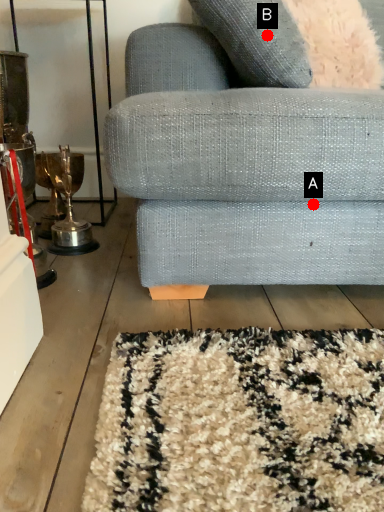
Question: Two points are circled on the image, labeled by A and B beside each circle. Which of the following is the closest to the observer?

Choices:
 (A) A is closer
 (B) B is closer

Answer: (B)